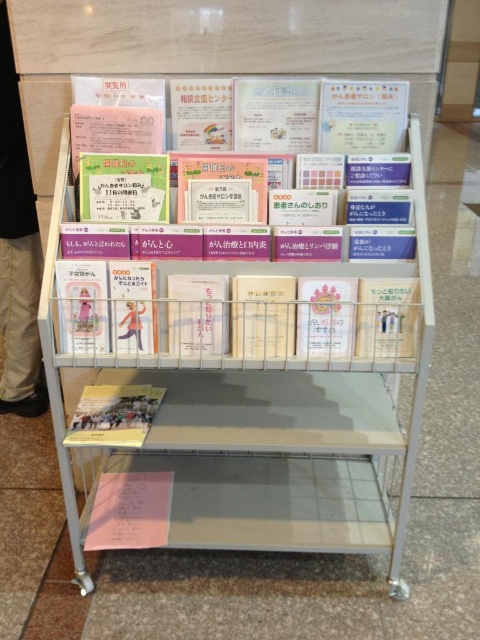
From the picture: Which is more to the left, yellow paper book at lower left or white paper book at center?

yellow paper book at lower left is more to the left.

Which is behind, point (72, 436) or point (177, 320)?

Positioned behind is point (72, 436).

I want to click on yellow paper book at lower left, so click(113, 416).

Locate an element on the screen. The height and width of the screenshot is (640, 480). yellow paper book at lower left is located at coordinates (113, 416).

Which is behind, point (371, 170) or point (377, 289)?

The point (371, 170) is more distant.

Does point (183, 292) lie in front of point (376, 282)?

No, it is behind (376, 282).

Identify the location of matte plastic book at center. This screenshot has width=480, height=640. (252, 246).

What are the coordinates of `matte plastic book at center` in the screenshot? It's located at (252, 246).

Who is taller, matte plastic book at center or yellow paper book at lower left?

matte plastic book at center is taller.

Is point (347, 211) closer to camera compared to point (98, 440)?

Yes.

Does point (109, 257) lie in front of point (99, 410)?

Yes, it is.

This screenshot has height=640, width=480. What are the coordinates of `matte plastic book at center` in the screenshot? It's located at (252, 246).